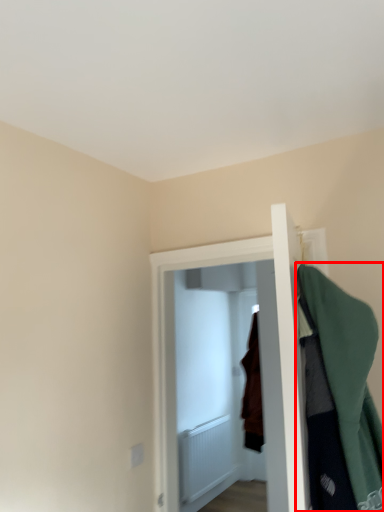
Question: From the image, what is the correct spatial relationship of cloak (annotated by the red box) in relation to door?

Choices:
 (A) left
 (B) right

Answer: (B)